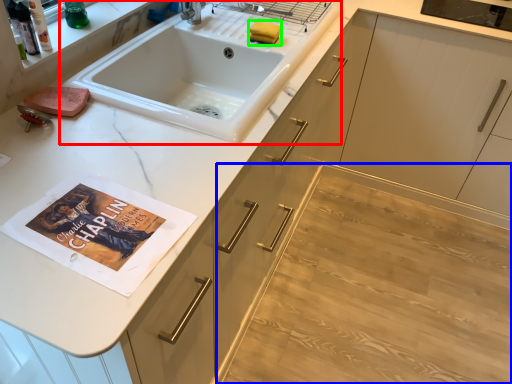
Question: Which object is positioned closest to sink (highlighted by a red box)? Select from plain (highlighted by a blue box) and soap (highlighted by a green box).

Choices:
 (A) plain
 (B) soap

Answer: (B)